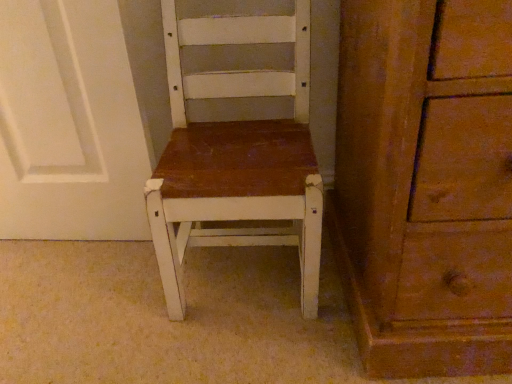
Identify the location of free point below matte white chair at center (from a real-world perspective). (245, 272).